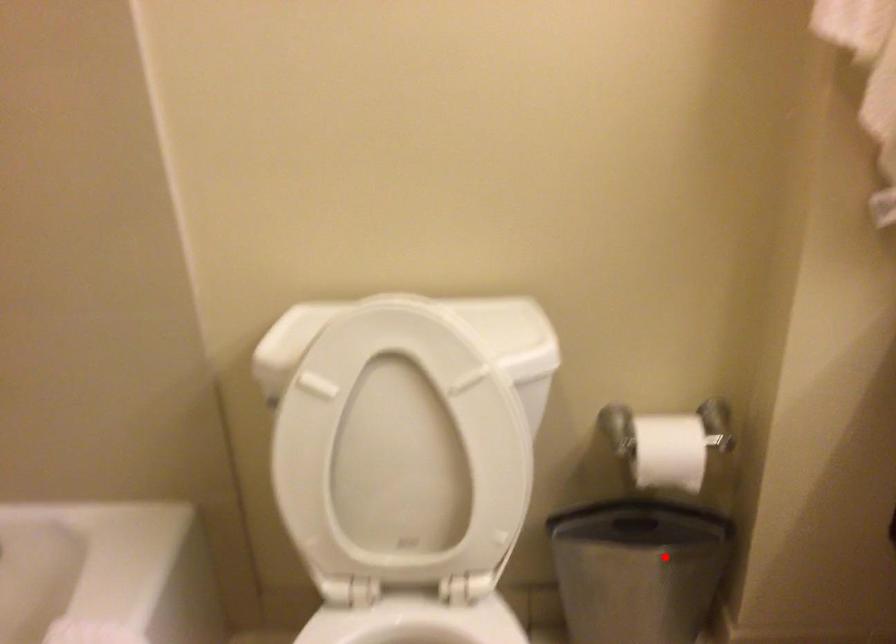
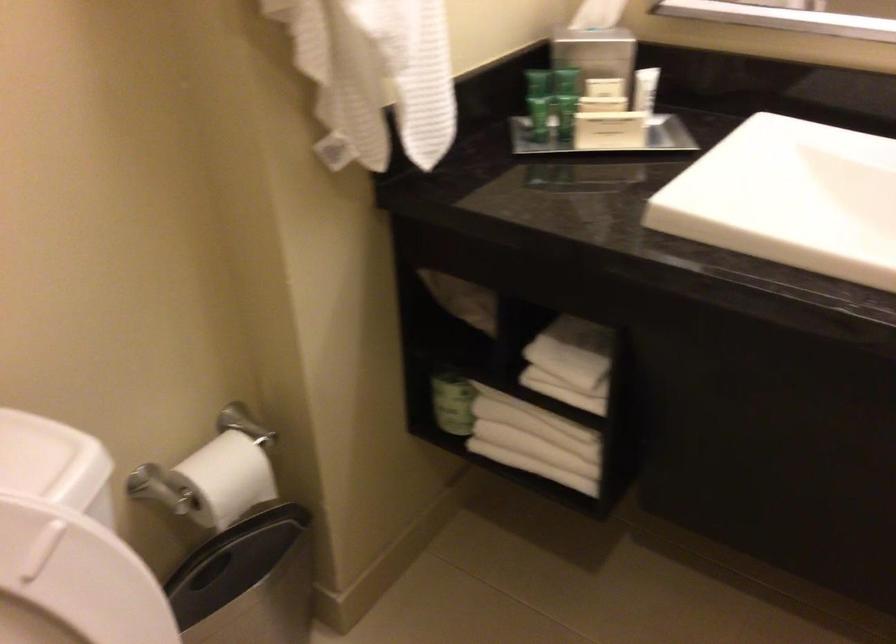
Where in the second image is the point corresponding to the highlighted location from the first image?

(247, 582)